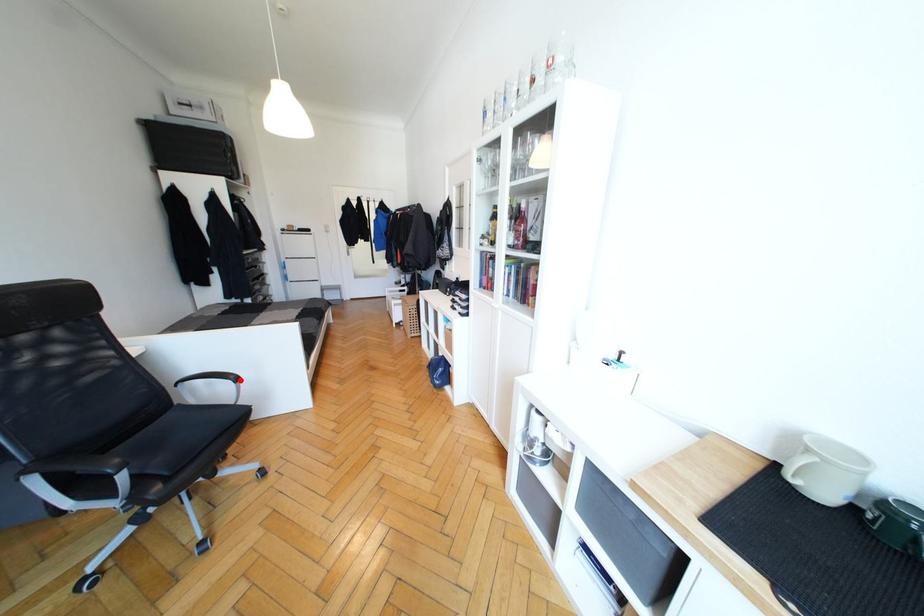
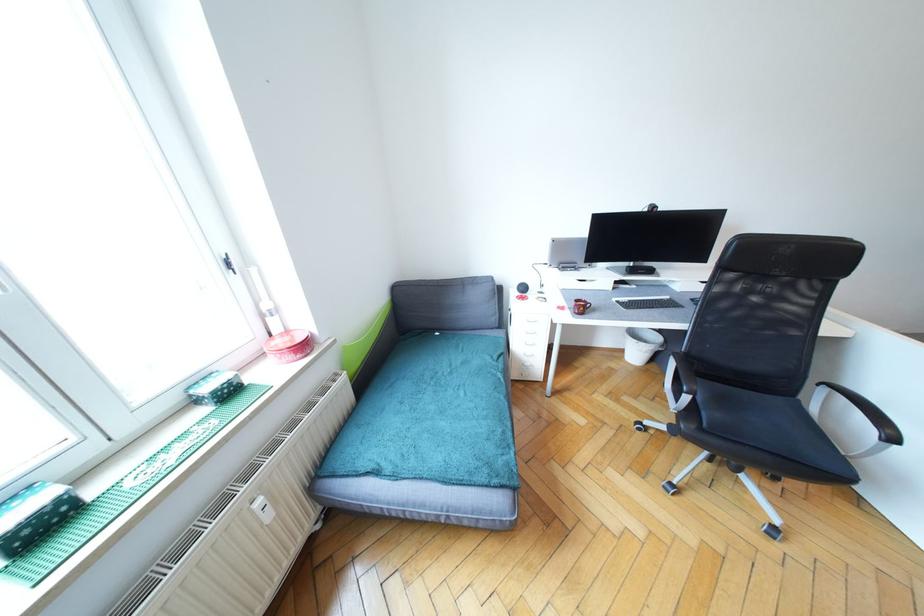
Question: I am providing you with two images of the same scene from different viewpoints. A red point is marked on the first image. Can you still see the location of the red point in image 2?

Choices:
 (A) Yes
 (B) No

Answer: (A)